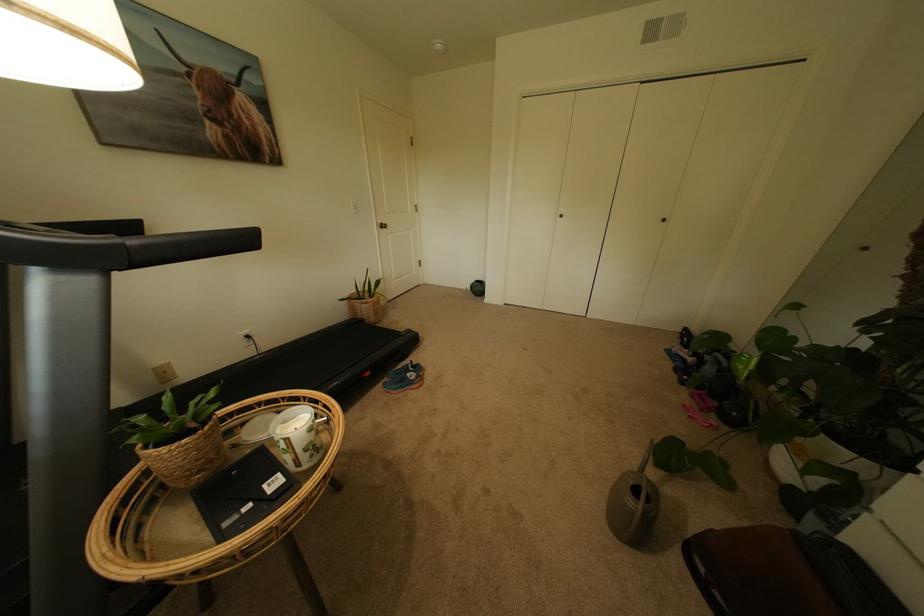
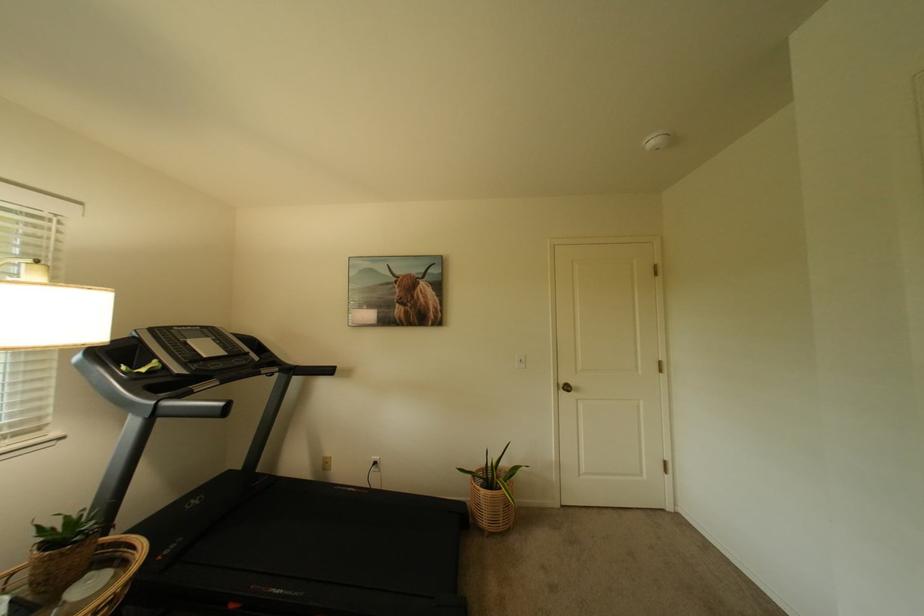
In the second image, find the point that corresponds to (x=382, y=314) in the first image.

(495, 515)